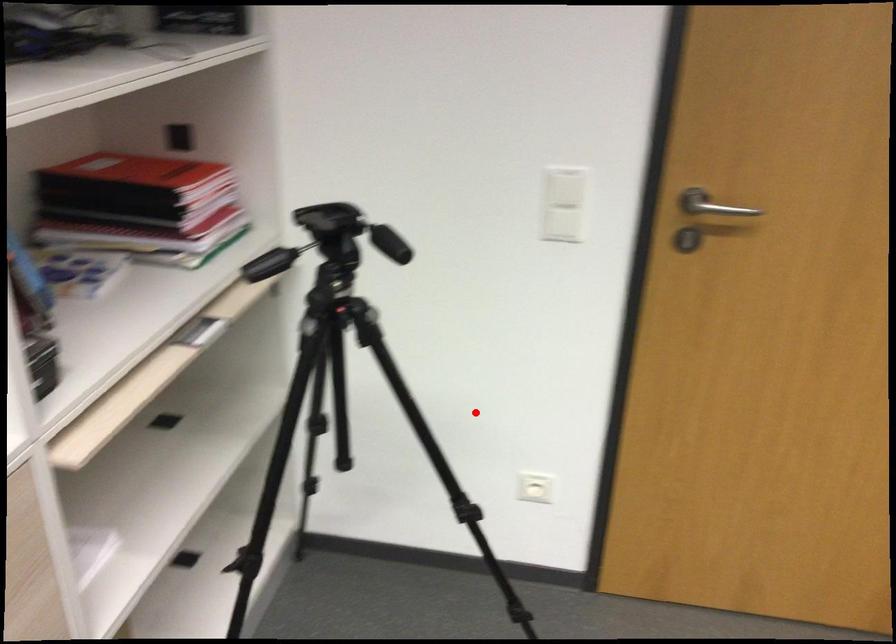
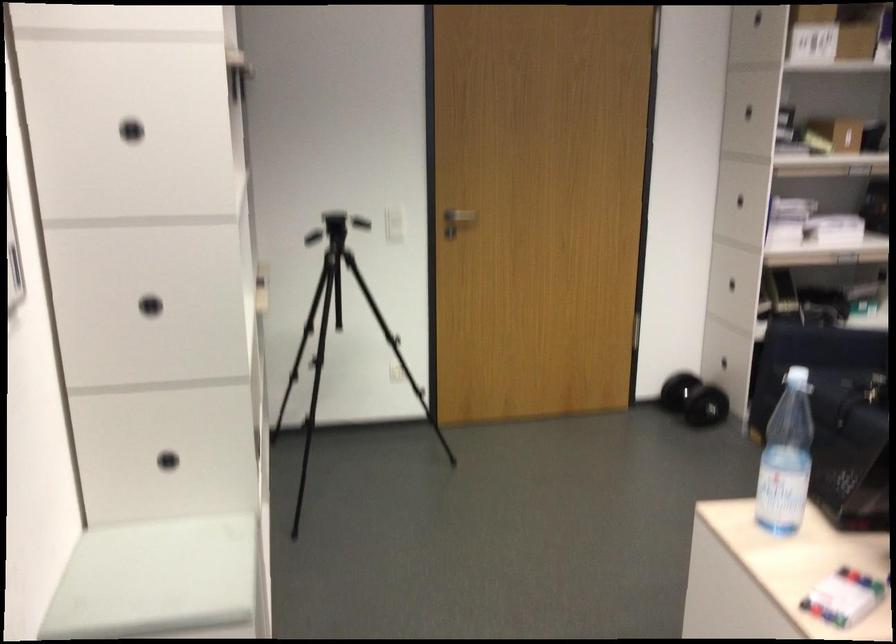
The point at the highlighted location is marked in the first image. Where is the corresponding point in the second image?

(339, 334)